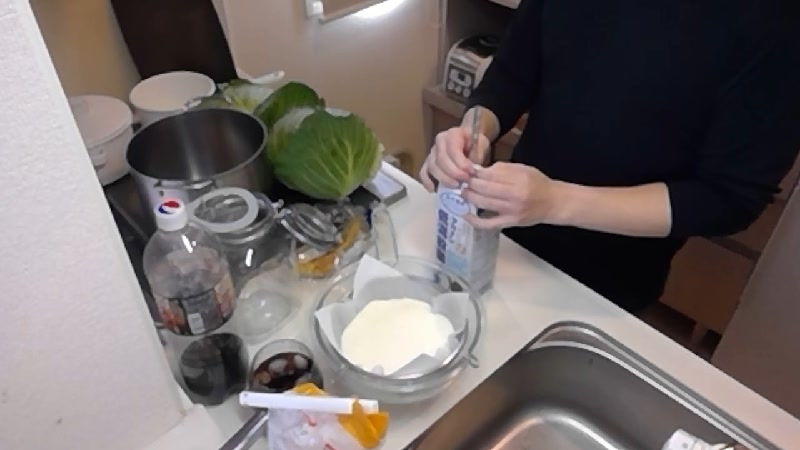
The image size is (800, 450). Identify the location of window. (370, 19).